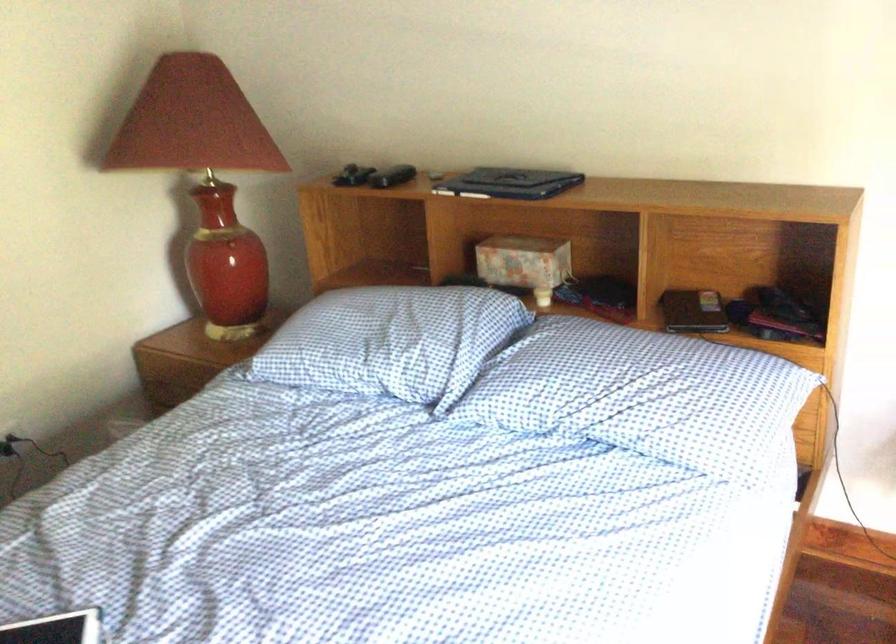
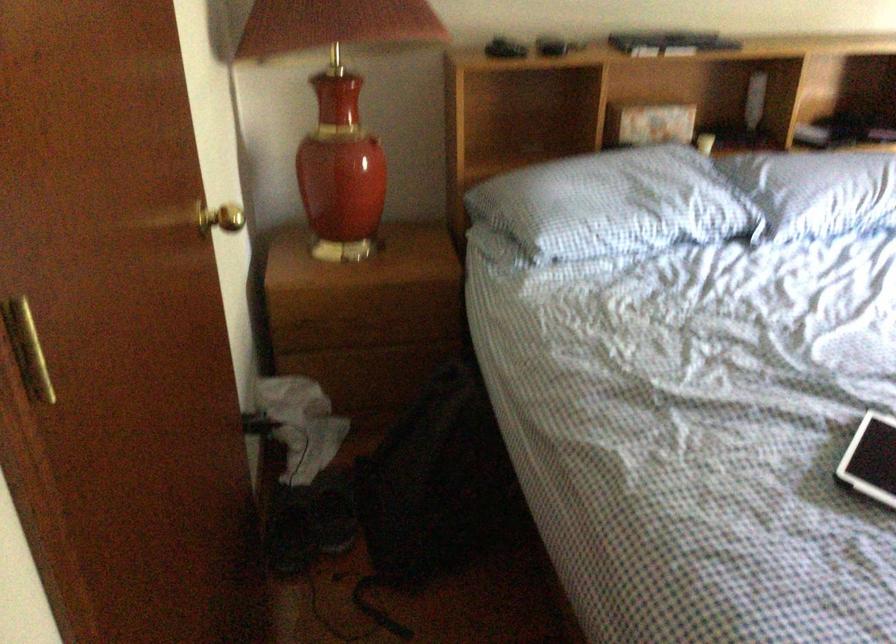
Question: I am providing you with two images of the same scene from different viewpoints. Please identify which objects are invisible in image2.

Choices:
 (A) black cable
 (B) lamp switch
 (C) blue checkered pillow
 (D) gold door knob

Answer: (B)